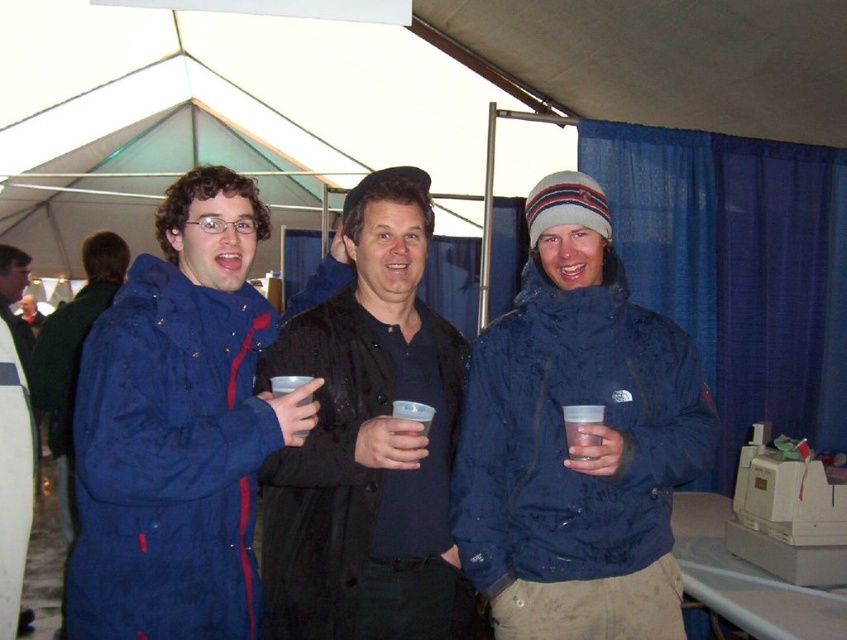
You are standing at the entrance of the tent and want to locate the blue matte jacket at center. According to the coordinates provided, in which direction should you look relative to your current position?

The blue matte jacket at center is located at coordinates point [576,442]. Since the coordinate system is not specified, it is recommended to look towards the central area of the tent where the jacket is most likely positioned.

You are standing at point (x=436, y=378) and want to move to the tent entrance. There is an obstacle at point (x=496, y=461). Can you walk straight ahead without going around the obstacle?

Point (x=496, y=461) is in front of point (x=436, y=378), so you would encounter the obstacle first before reaching the tent entrance. You need to go around it.

From the picture: You are organizing a photo shoot and need to arrange two jackets on a mannequin stand. The stand has limited space. Given the blue matte jacket at center and the black matte jacket at center, which jacket requires more space due to its size?

The blue matte jacket at center requires more space because its width is larger than the black matte jacket at center.